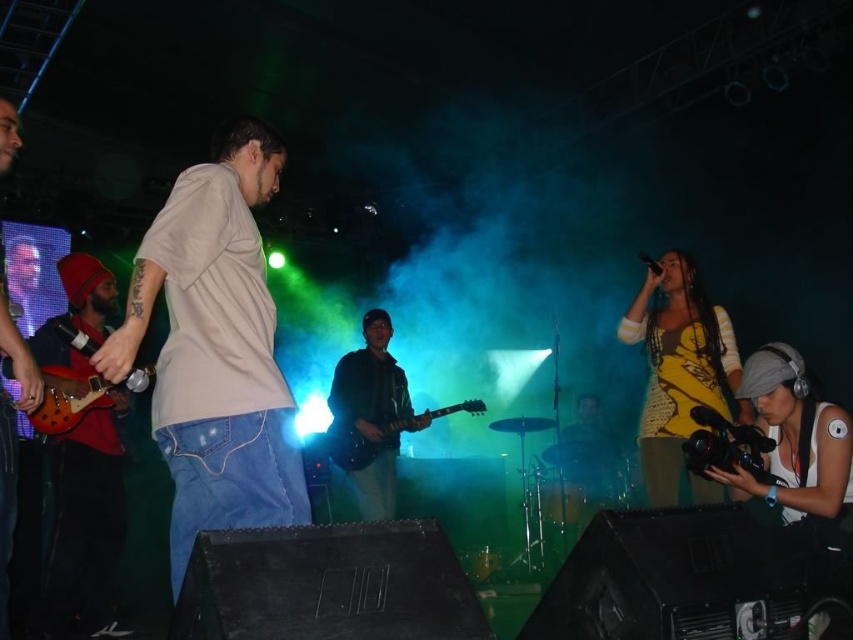
You are a photographer at the live music performance and need to capture a photo of the white matte shirt at center and the white matte headphones at lower right. Based on their positions, which object is closer to the camera?

The white matte shirt at center is above the white matte headphones at lower right, meaning it is closer to the camera.

You are a photographer standing at the back of the venue. You want to take a photo that includes both the white matte shirt at center and the shiny red guitar at left. What is the minimum distance you need to maintain between the camera and the subjects to ensure both are in focus?

The minimum distance you need to maintain between the camera and the subjects to ensure both the white matte shirt at center and the shiny red guitar at left are in focus is 6.18 feet, as this is the distance between the two subjects.

You are a photographer at the music event and want to capture a photo that includes both the white matte shirt at center and the yellow crochet top at center. Which of the two clothing items will appear larger in the final photo?

The white matte shirt at center will appear larger in the final photo because it is bigger than the yellow crochet top at center.